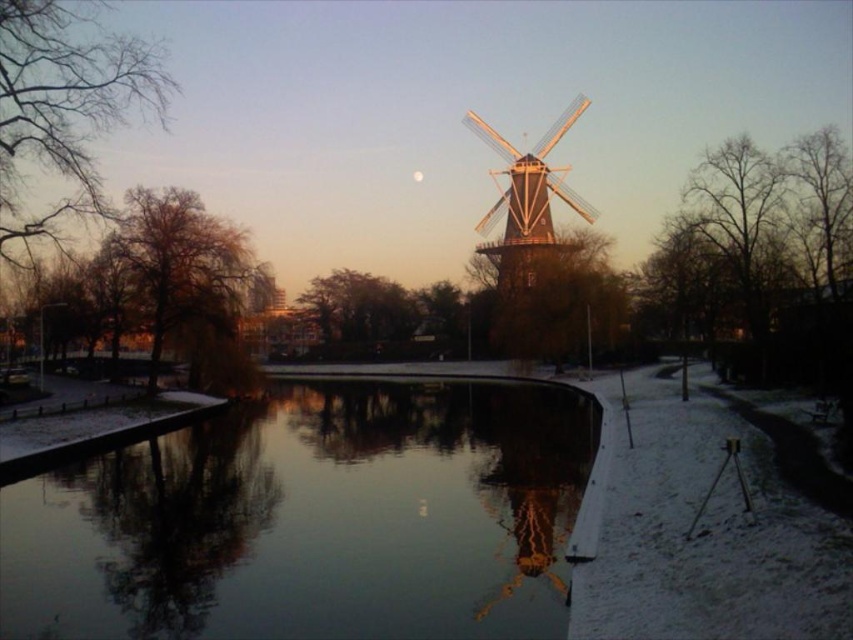
Question: Is smooth water at center to the right of wooden windmill at center from the viewer's perspective?

Choices:
 (A) yes
 (B) no

Answer: (B)

Question: Is smooth water at center further to camera compared to wooden windmill at center?

Choices:
 (A) no
 (B) yes

Answer: (A)

Question: Among these objects, which one is nearest to the camera?

Choices:
 (A) smooth water at center
 (B) wooden windmill at center

Answer: (A)

Question: Does smooth water at center have a greater width compared to wooden windmill at center?

Choices:
 (A) yes
 (B) no

Answer: (A)

Question: Which point is farther from the camera taking this photo?

Choices:
 (A) 572,497
 (B) 564,172

Answer: (B)